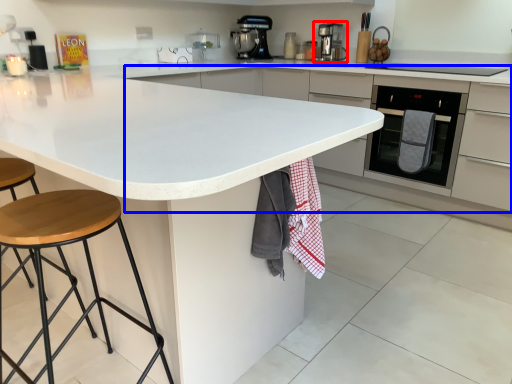
Question: Which point is further to the camera, kitchen appliance (highlighted by a red box) or cabinetry (highlighted by a blue box)?

Choices:
 (A) kitchen appliance
 (B) cabinetry

Answer: (A)